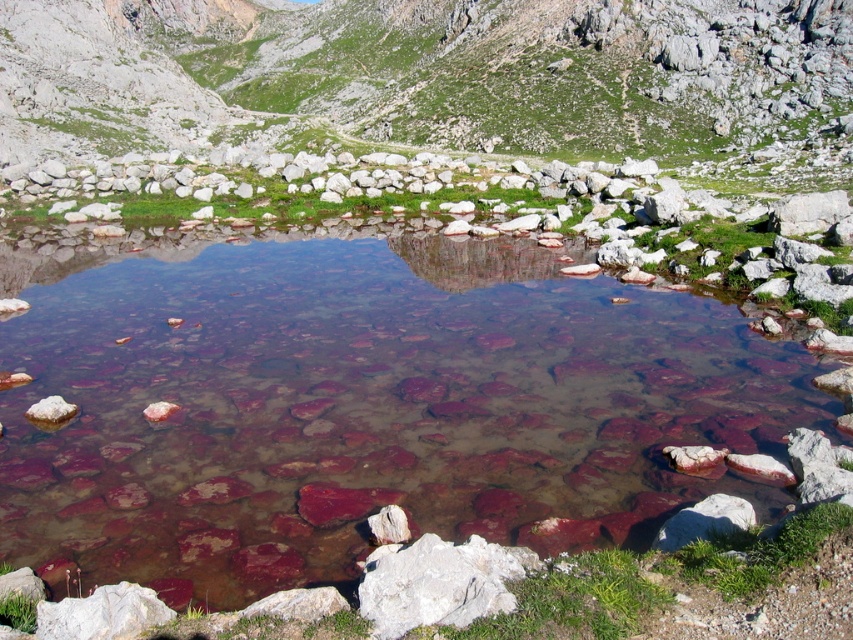
Based on the scene description, where is the green grassy hillside at upper center located in terms of its 2D coordinates?

The green grassy hillside at upper center is located at the 2D coordinates point (425, 72).

You are a hiker planning to cross from the clear glass water at center to the green grassy hillside at upper center. Given that your backpack can only carry enough supplies for a 100 meter journey, will you have enough supplies to make the trip?

The clear glass water at center and green grassy hillside at upper center are 94.93 meters apart from each other. Since your backpack can carry supplies for 100 meters, you have enough supplies to make the trip as 94.93 meters is less than 100 meters.